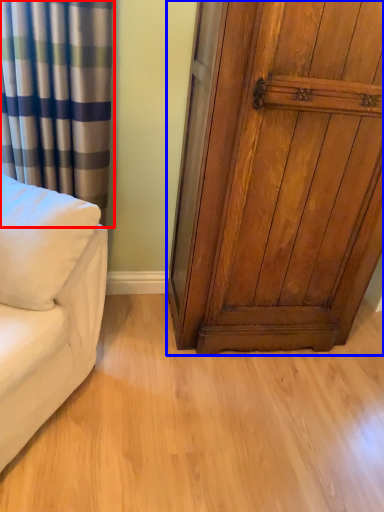
Question: Which of the following is the closest to the observer, curtain (highlighted by a red box) or door (highlighted by a blue box)?

Choices:
 (A) curtain
 (B) door

Answer: (B)